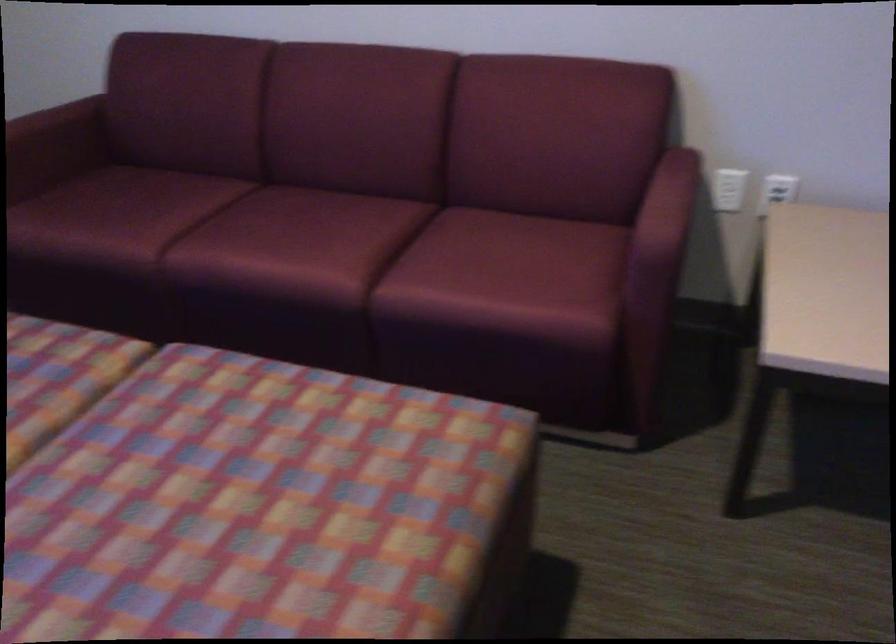
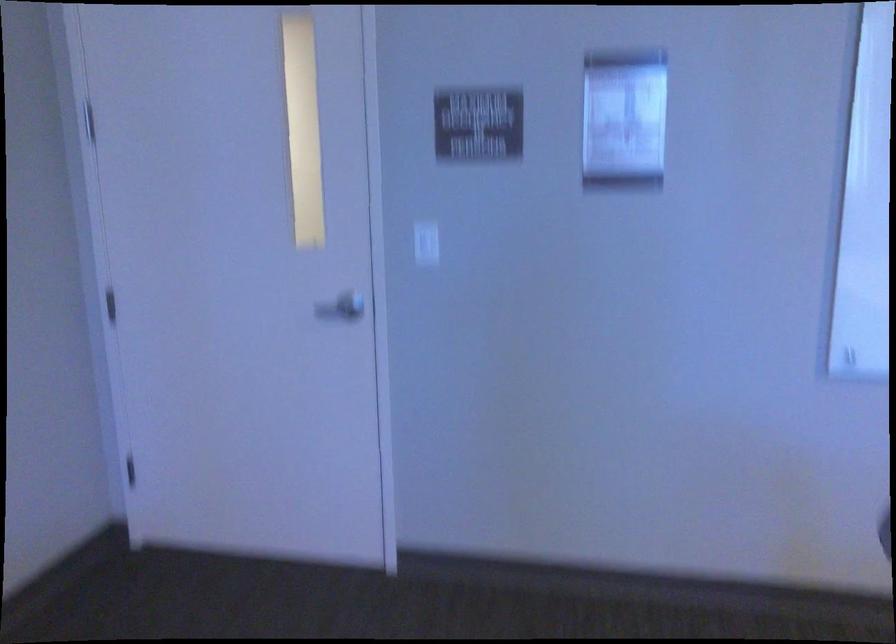
Question: How did the camera likely rotate?

Choices:
 (A) Left
 (B) Right
 (C) Up
 (D) Down

Answer: (B)